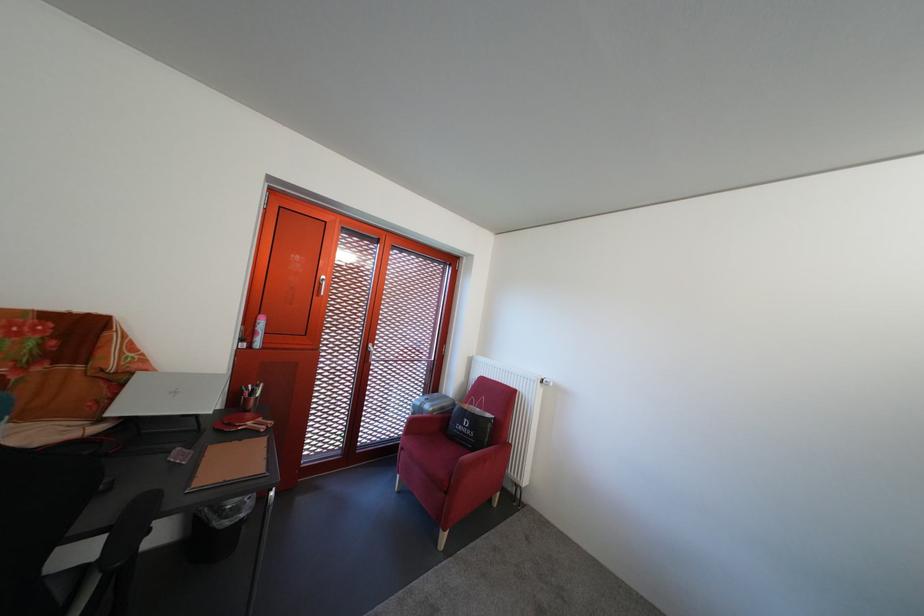
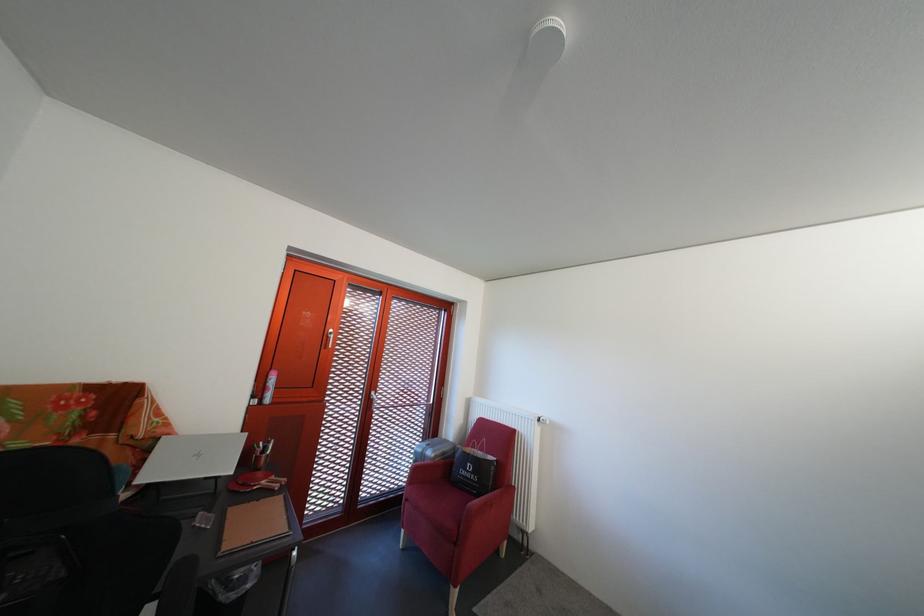
In the second image, find the point that corresponds to point (382, 352) in the first image.

(383, 400)